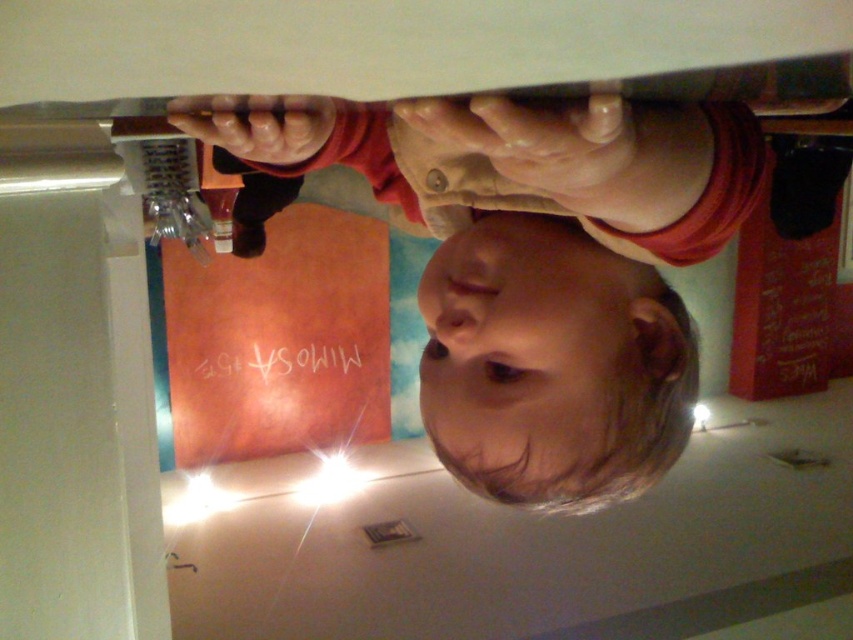
You are a photographer trying to capture a portrait of the smooth skin child at center and the smooth skin head at center. Based on their positions, which one should you focus on first if you want to capture them both in the same frame without moving the camera?

The smooth skin child at center is to the left of smooth skin head at center, so you should focus on the smooth skin child at center first to ensure both are in the frame.

You are a delivery robot with a height of 60 centimeters. You need to navigate through a narrow space to reach a delivery point located at coordinates point (314, 157). According to the scene, can you safely pass through the space without hitting your head?

The point (314, 157) is 64.47 centimeters away from the viewer. Since the robot is 60 centimeters tall, it can safely pass under the space without hitting its head as there is sufficient clearance.